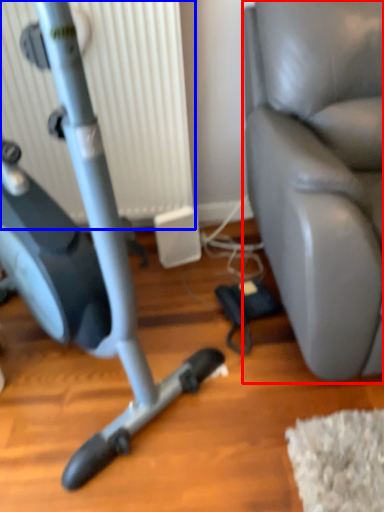
Question: Which object is closer to the camera taking this photo, swivel chair (highlighted by a red box) or radiator (highlighted by a blue box)?

Choices:
 (A) swivel chair
 (B) radiator

Answer: (A)